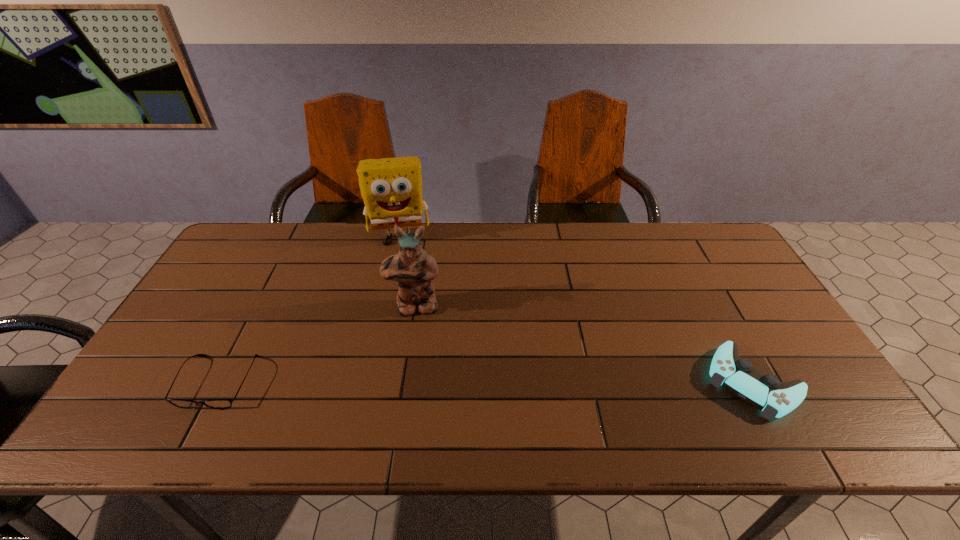
Locate an element on the screen. The width and height of the screenshot is (960, 540). free space on the desktop that is between the shortest object and the second shortest object and is positioned on the front-facing side of the figurine is located at coordinates (413, 382).

Identify the location of free space on the desktop that is between the leftmost object and the rightmost object and is positioned on the face of the farthest object. (409, 382).